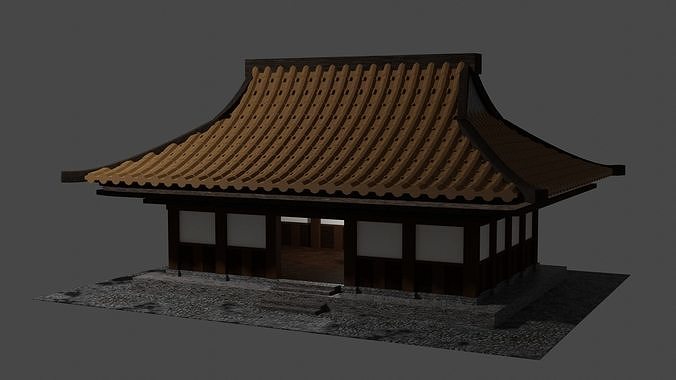
This screenshot has width=676, height=380. Identify the location of stairs. pos(297,306), pos(299,284).